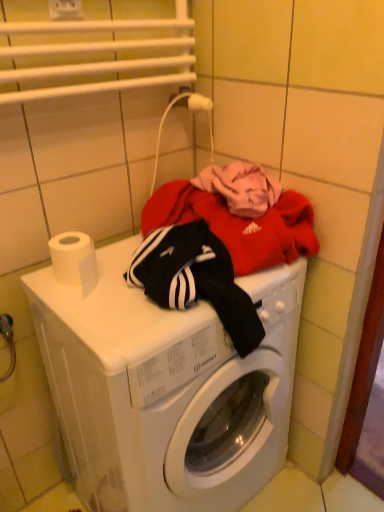
Question: Does white matte toilet paper at upper left have a greater height compared to white plastic washing machine at center?

Choices:
 (A) no
 (B) yes

Answer: (A)

Question: Is white matte toilet paper at upper left far away from white plastic washing machine at center?

Choices:
 (A) no
 (B) yes

Answer: (A)

Question: Considering the relative sizes of white matte toilet paper at upper left and white plastic washing machine at center in the image provided, is white matte toilet paper at upper left smaller than white plastic washing machine at center?

Choices:
 (A) no
 (B) yes

Answer: (B)

Question: From a real-world perspective, is white matte toilet paper at upper left below white plastic washing machine at center?

Choices:
 (A) yes
 (B) no

Answer: (B)

Question: Is white matte toilet paper at upper left not inside white plastic washing machine at center?

Choices:
 (A) yes
 (B) no

Answer: (A)

Question: Considering their positions, is white matte toilet paper at upper left located in front of or behind white plastic washing machine at center?

Choices:
 (A) behind
 (B) front

Answer: (A)

Question: Visually, is white matte toilet paper at upper left positioned to the left or to the right of white plastic washing machine at center?

Choices:
 (A) right
 (B) left

Answer: (B)

Question: From the image's perspective, is white matte toilet paper at upper left positioned above or below white plastic washing machine at center?

Choices:
 (A) above
 (B) below

Answer: (A)

Question: From a real-world perspective, is white matte toilet paper at upper left physically located above or below white plastic washing machine at center?

Choices:
 (A) above
 (B) below

Answer: (A)

Question: Do you think white matte toilet paper at upper left is within white plastic electric outlet at upper center, or outside of it?

Choices:
 (A) inside
 (B) outside

Answer: (B)

Question: Relative to white plastic electric outlet at upper center, is white matte toilet paper at upper left in front or behind?

Choices:
 (A) front
 (B) behind

Answer: (A)

Question: From a real-world perspective, is white matte toilet paper at upper left positioned above or below white plastic electric outlet at upper center?

Choices:
 (A) above
 (B) below

Answer: (B)

Question: Is white matte toilet paper at upper left taller or shorter than white plastic electric outlet at upper center?

Choices:
 (A) short
 (B) tall

Answer: (B)

Question: In terms of width, does white plastic electric outlet at upper center look wider or thinner when compared to white matte toilet paper at upper left?

Choices:
 (A) thin
 (B) wide

Answer: (A)

Question: Considering the positions of point (56, 12) and point (48, 243), is point (56, 12) closer or farther from the camera than point (48, 243)?

Choices:
 (A) closer
 (B) farther

Answer: (A)